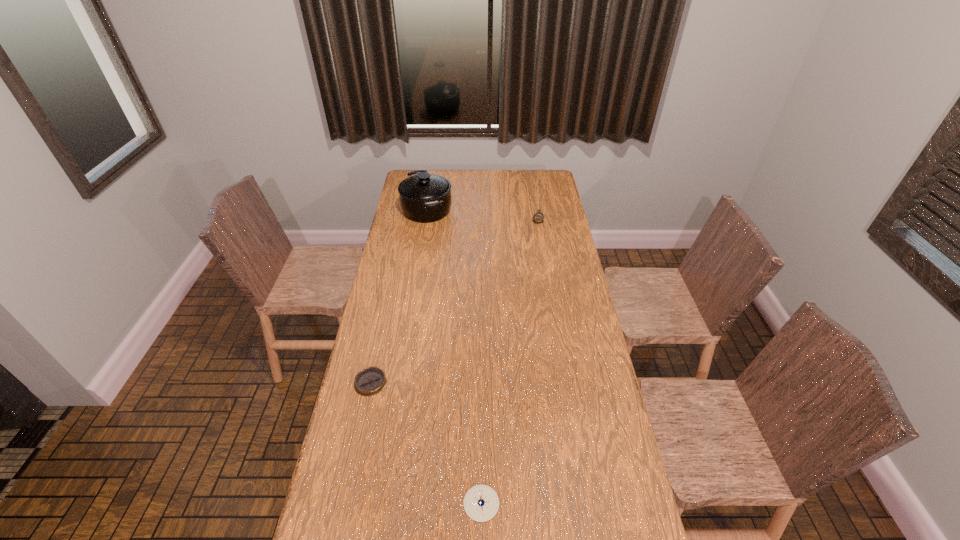
I want to click on the tallest object, so click(x=424, y=198).

The height and width of the screenshot is (540, 960). In order to click on the third shortest object in this screenshot , I will do `click(538, 217)`.

The image size is (960, 540). I want to click on the rightmost object, so click(x=538, y=217).

This screenshot has width=960, height=540. Find the location of `the third tallest object`. the third tallest object is located at coordinates (481, 503).

You are a GUI agent. You are given a task and a screenshot of the screen. Output one action in this format:
    pyautogui.click(x=<x>, y=<y>)
    Task: Click on the third object from left to right
    
    Given the screenshot: What is the action you would take?
    pyautogui.click(x=481, y=503)

Locate an element on the screen. The height and width of the screenshot is (540, 960). the shortest object is located at coordinates (370, 381).

Locate an element on the screen. the second farthest compass is located at coordinates (370, 381).

This screenshot has height=540, width=960. In order to click on vacant space located 0.110m on the right of the saucepan in this screenshot , I will do `click(473, 210)`.

Locate an element on the screen. The height and width of the screenshot is (540, 960). free space located 0.400m on the face of the rightmost object is located at coordinates (547, 279).

Locate an element on the screen. free spot located on the left of the second tallest compass is located at coordinates (442, 503).